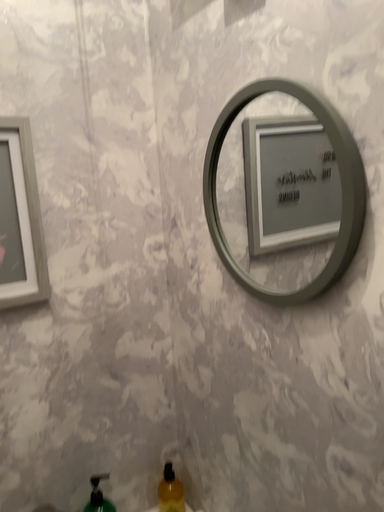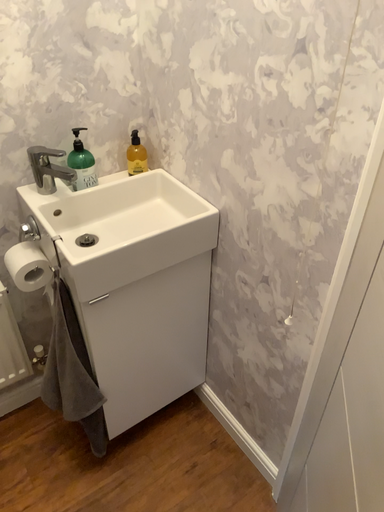
Question: Which way did the camera rotate in the video?

Choices:
 (A) rotated downward
 (B) rotated upward

Answer: (A)